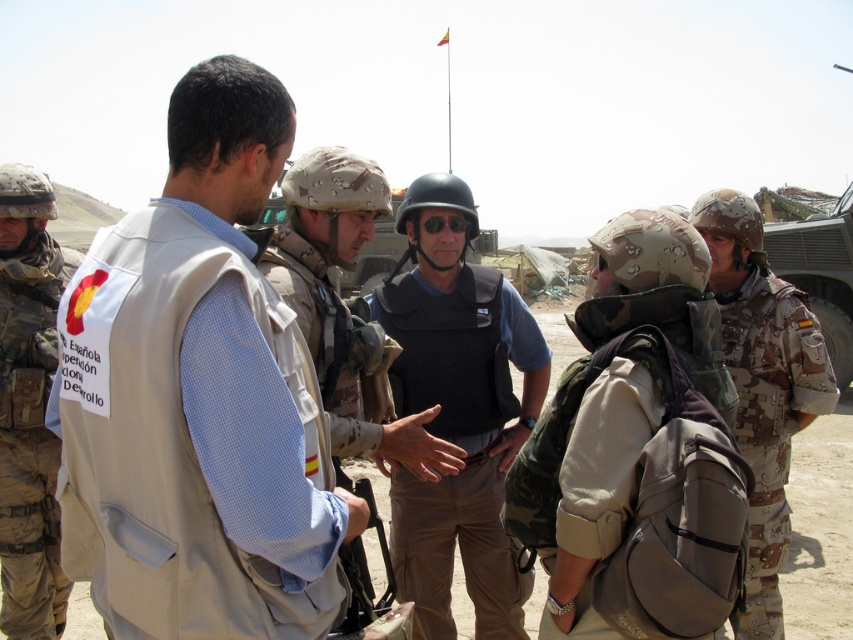
You are a drone operator controlling a drone that is 1.8 meters away from the camera. You need to fly the drone to the point marked at coordinates point (186, 388). Can the drone reach that point without colliding with any obstacles?

The distance between point (186, 388) and the camera is 1.72 meters. Since the drone is already 1.8 meters away from the camera, it can reach the point as the distance is slightly less than the drone can travel.

You are a photographer trying to capture a clear shot of the beige fabric vest at center and the camo fabric backpack at center from above. Which object should you focus on first to ensure it appears larger in your photo?

The beige fabric vest at center is taller than the camo fabric backpack at center, so focusing on the beige fabric vest at center first will ensure it appears larger in the photo.

You are a field medic trying to identify the correct vest to administer first aid. The beige fabric vest at center and the light beige vest at center are both in your line of sight. Which vest is wider?

The beige fabric vest at center is wider than the light beige vest at center according to the description.